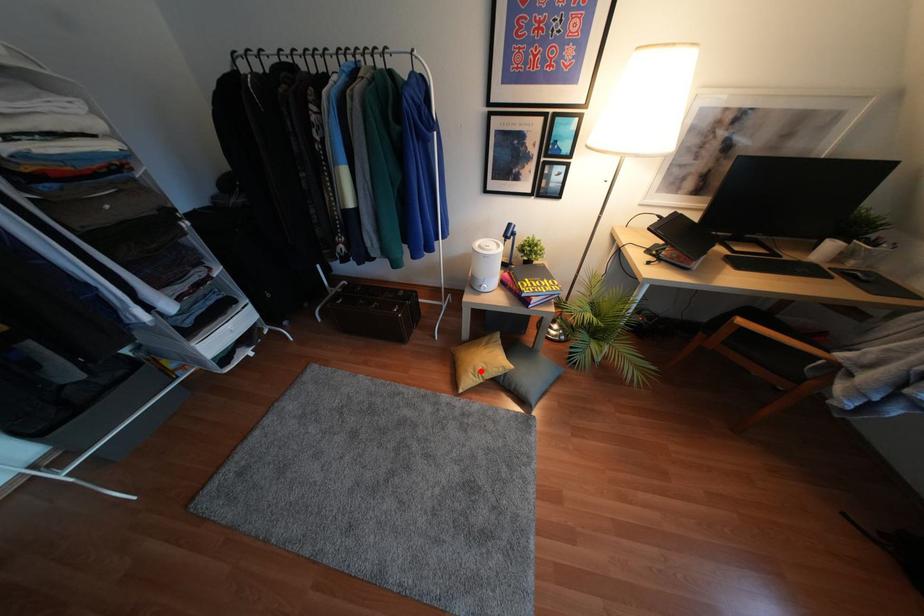
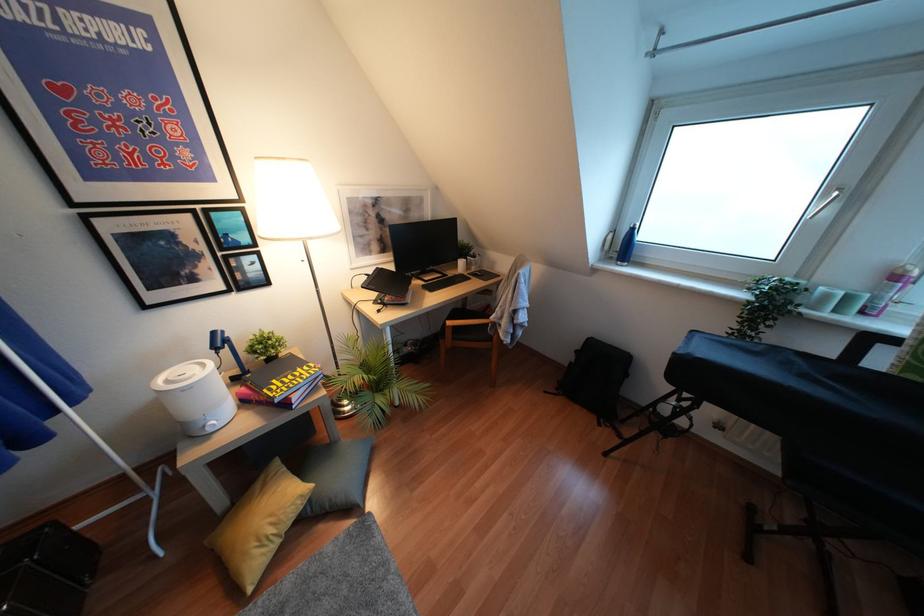
Where in the second image is the point corresponding to the highlighted location from the first image?

(271, 530)